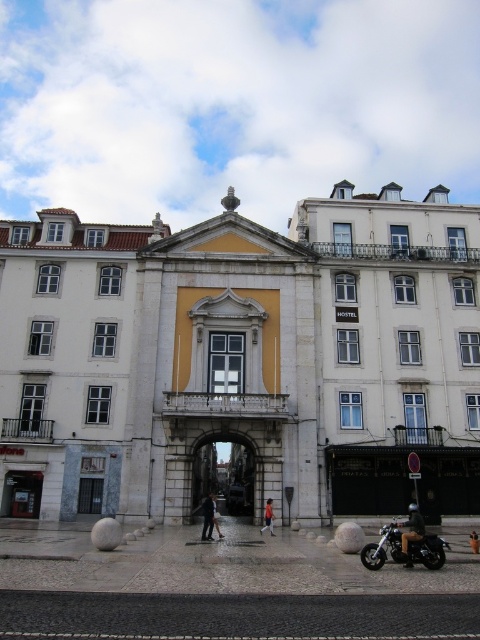
You are standing in front of the historic building and see a point marked at coordinates (406,545). What object is located at that point?

The point at coordinates (406,545) corresponds to the shiny black motorcycle at lower right.

You are standing in front of the historic building and want to walk towards the two points marked on the ground. Which point, point [393,538] or point [204,538], will you reach first?

You will reach point [393,538] first because it is closer to you than point [204,538].

You are a delivery person who needs to drive a motorcycle through the archway. The shiny black motorcycle at lower right is your motorcycle. Can you safely pass through the dark gray stone archway at center?

The dark gray stone archway at center is positioned under the shiny black motorcycle at lower right, which means the motorcycle is already under the archway. Therefore, you can safely pass through the dark gray stone archway at center with your shiny black motorcycle at lower right.